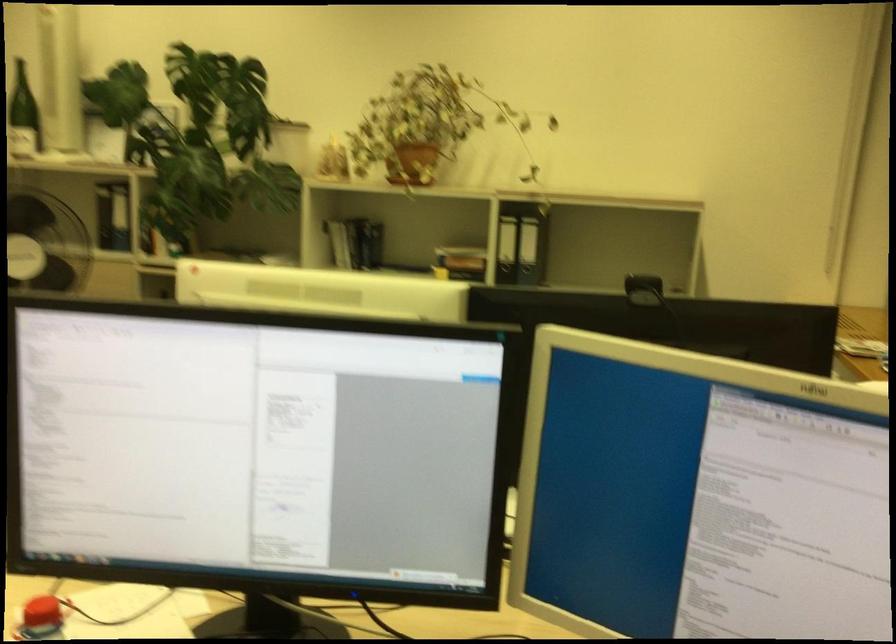
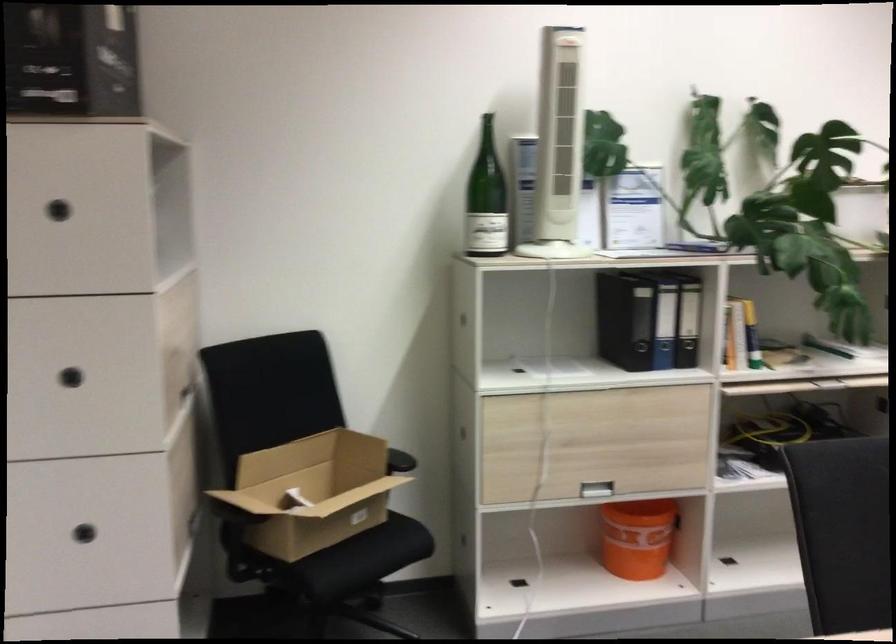
Which direction would the cameraman need to move to produce the second image?

The cameraman moved toward left, forward.